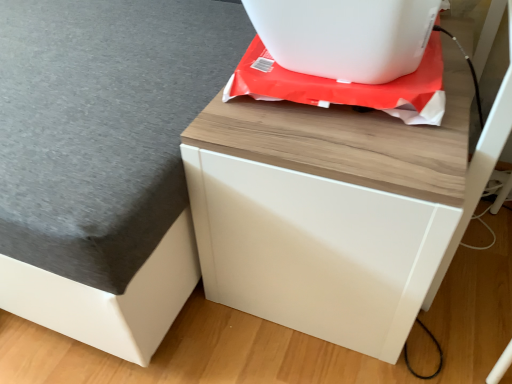
Question: Is there a large distance between white plastic appliance at upper center and white matte drawer at center?

Choices:
 (A) no
 (B) yes

Answer: (A)

Question: Is white plastic appliance at upper center thinner than white matte drawer at center?

Choices:
 (A) yes
 (B) no

Answer: (A)

Question: From a real-world perspective, is white plastic appliance at upper center positioned under white matte drawer at center based on gravity?

Choices:
 (A) yes
 (B) no

Answer: (B)

Question: Considering the relative positions of white plastic appliance at upper center and white matte drawer at center in the image provided, is white plastic appliance at upper center to the right of white matte drawer at center from the viewer's perspective?

Choices:
 (A) no
 (B) yes

Answer: (A)

Question: Is white plastic appliance at upper center behind white matte drawer at center?

Choices:
 (A) yes
 (B) no

Answer: (A)

Question: Does white plastic appliance at upper center have a lesser height compared to white matte drawer at center?

Choices:
 (A) yes
 (B) no

Answer: (A)

Question: Is white plastic appliance at upper center shorter than wooden table at upper right?

Choices:
 (A) yes
 (B) no

Answer: (A)

Question: Does white plastic appliance at upper center have a greater width compared to wooden table at upper right?

Choices:
 (A) yes
 (B) no

Answer: (B)

Question: From the image's perspective, is white plastic appliance at upper center located above wooden table at upper right?

Choices:
 (A) no
 (B) yes

Answer: (B)

Question: Can you confirm if white plastic appliance at upper center is positioned to the left of wooden table at upper right?

Choices:
 (A) yes
 (B) no

Answer: (B)

Question: From a real-world perspective, is white plastic appliance at upper center on wooden table at upper right?

Choices:
 (A) no
 (B) yes

Answer: (B)

Question: Would you say white plastic appliance at upper center contains wooden table at upper right?

Choices:
 (A) no
 (B) yes

Answer: (A)

Question: Is white matte drawer at center aimed at white plastic appliance at upper center?

Choices:
 (A) no
 (B) yes

Answer: (A)